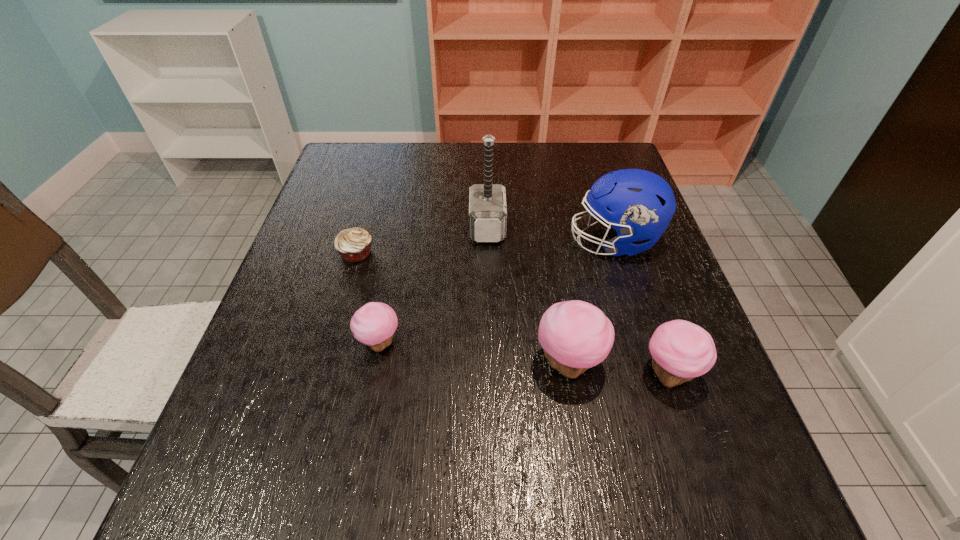
Point out which cupcake is positioned as the nearest to the tallest cupcake. Please provide its 2D coordinates. Your answer should be formatted as a tuple, i.e. [(x, y)], where the tuple contains the x and y coordinates of a point satisfying the conditions above.

[(680, 350)]

At what (x,y) coordinates should I click in order to perform the action: click on the closest cupcake relative to the fourth tallest object. Please return your answer as a coordinate pair (x, y). Looking at the image, I should click on (575, 335).

The width and height of the screenshot is (960, 540). I want to click on vacant space that satisfies the following two spatial constraints: 1. on the front side of the rightmost cupcake; 2. on the left side of the leftmost cupcake, so click(373, 374).

I want to click on vacant position in the image that satisfies the following two spatial constraints: 1. for striking with the head of the fourth object from right to left; 2. on the front side of the shortest object, so click(488, 253).